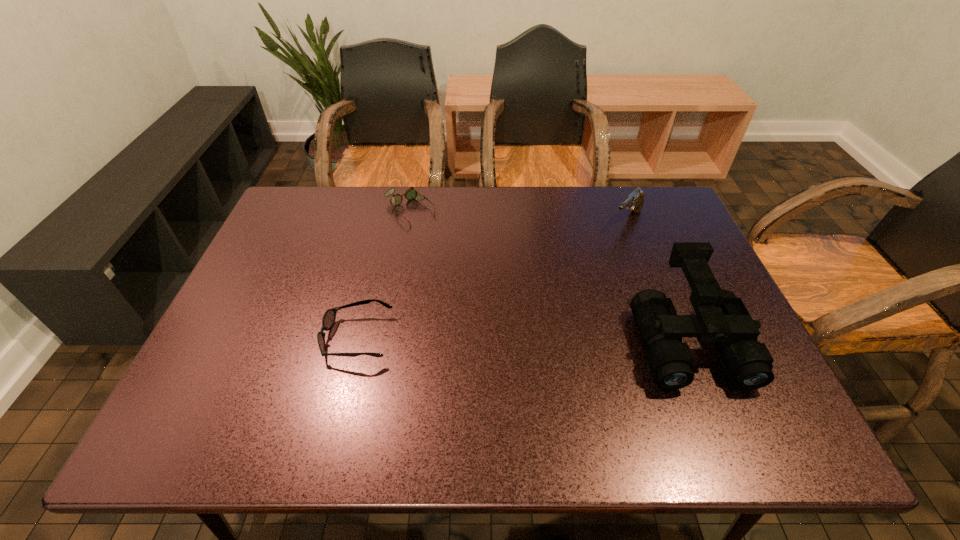
Where is `empty location between the spectacles and the pistol`? This screenshot has height=540, width=960. empty location between the spectacles and the pistol is located at coordinates (518, 216).

The height and width of the screenshot is (540, 960). Identify the location of vacant area between the sunglasses and the second tallest object. (492, 279).

What are the coordinates of `vacant space that is in between the spectacles and the sunglasses` in the screenshot? It's located at (383, 274).

You are a GUI agent. You are given a task and a screenshot of the screen. Output one action in this format:
    pyautogui.click(x=<x>, y=<y>)
    Task: Click on the vacant area that lies between the second tallest object and the spectacles
    Image resolution: width=960 pixels, height=540 pixels.
    Given the screenshot: What is the action you would take?
    pyautogui.click(x=518, y=216)

The height and width of the screenshot is (540, 960). I want to click on vacant area between the binoculars and the sunglasses, so click(x=522, y=338).

At what (x,y) coordinates should I click in order to perform the action: click on object that is the second closest one to the sunglasses. Please return your answer as a coordinate pair (x, y). The height and width of the screenshot is (540, 960). Looking at the image, I should click on (722, 318).

Identify which object is the nearest to the third shortest object. Please provide its 2D coordinates. Your answer should be formatted as a tuple, i.e. [(x, y)], where the tuple contains the x and y coordinates of a point satisfying the conditions above.

[(722, 318)]

This screenshot has height=540, width=960. Find the location of `free spot that satisfies the following two spatial constraints: 1. on the front side of the spectacles; 2. on the right side of the second tallest object`. free spot that satisfies the following two spatial constraints: 1. on the front side of the spectacles; 2. on the right side of the second tallest object is located at coordinates (408, 221).